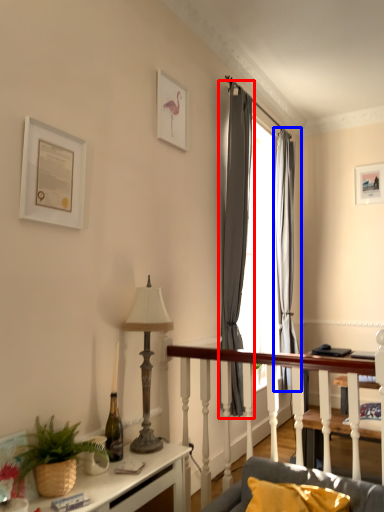
Question: Which of the following is the farthest to the observer, curtain (highlighted by a red box) or curtain (highlighted by a blue box)?

Choices:
 (A) curtain
 (B) curtain

Answer: (B)